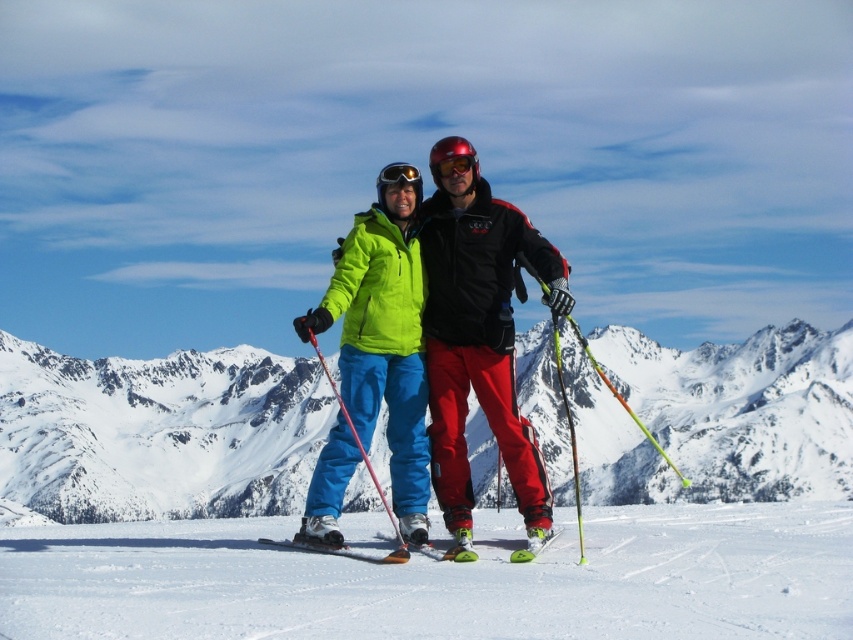
Is white snow at center wider than glossy plastic goggles at center?

Yes, white snow at center is wider than glossy plastic goggles at center.

In the scene shown: Between white snow at center and glossy plastic goggles at center, which one appears on the left side from the viewer's perspective?

Positioned to the left is glossy plastic goggles at center.

This screenshot has width=853, height=640. Describe the element at coordinates (444, 579) in the screenshot. I see `white snow at center` at that location.

You are a GUI agent. You are given a task and a screenshot of the screen. Output one action in this format:
    pyautogui.click(x=<x>, y=<y>)
    Task: Click on the white snow at center
    
    Given the screenshot: What is the action you would take?
    pyautogui.click(x=444, y=579)

Which is behind, point (432, 170) or point (419, 182)?

Point (432, 170)

Is glossy plastic goggles at center smaller than black matte goggles at center?

Yes.

Between point (437, 173) and point (399, 172), which one is positioned behind?

Positioned behind is point (437, 173).

Locate an element on the screen. The width and height of the screenshot is (853, 640). glossy plastic goggles at center is located at coordinates (454, 166).

Which is below, matte green jacket at center or green matte ski at center?

green matte ski at center

Who is more distant from viewer, [534,522] or [355,557]?

Point [534,522]

Find the location of a particular element. The image size is (853, 640). matte green jacket at center is located at coordinates (480, 342).